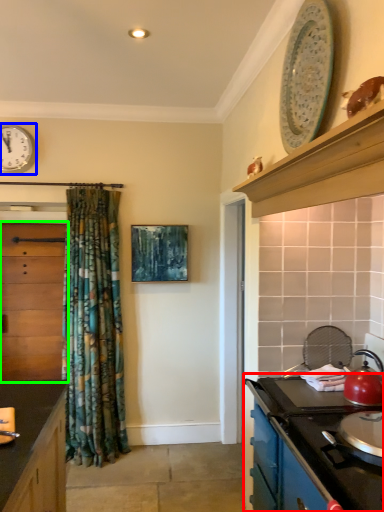
Question: Based on their relative distances, which object is nearer to cabinetry (highlighted by a red box)? Choose from clock (highlighted by a blue box) and cabinetry (highlighted by a green box).

Choices:
 (A) clock
 (B) cabinetry

Answer: (B)